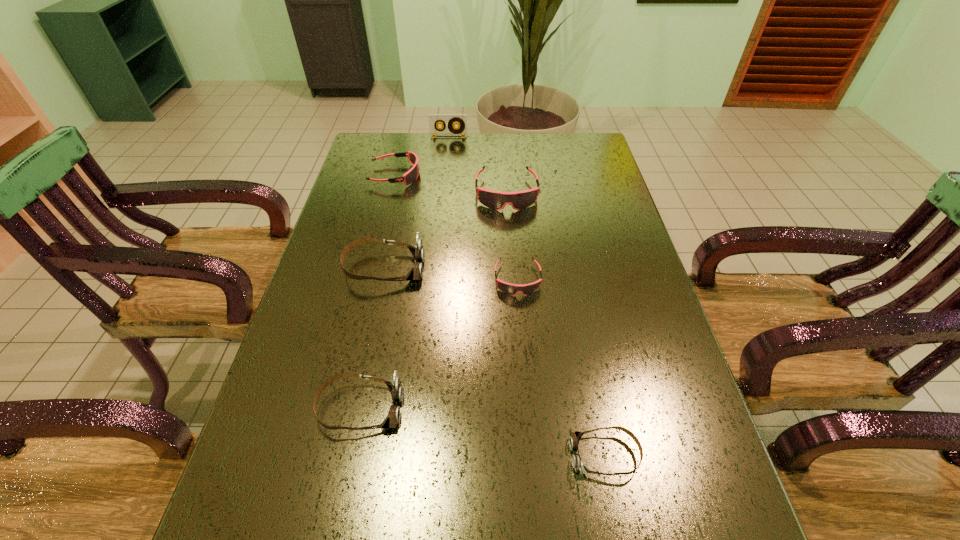
Identify which pink goggles is the nearest to the nearest pink goggles. Please provide its 2D coordinates. Your answer should be formatted as a tuple, i.e. [(x, y)], where the tuple contains the x and y coordinates of a point satisfying the conditions above.

[(495, 200)]

Where is `the third closest brown goggles to the second smallest pink goggles`? Image resolution: width=960 pixels, height=540 pixels. the third closest brown goggles to the second smallest pink goggles is located at coordinates (575, 437).

Find the location of a particular element. This screenshot has width=960, height=540. brown goggles that stands as the third closest to the videotape is located at coordinates (575, 437).

Where is `free space that satisfies the following two spatial constraints: 1. at the front of the tallest object with visible reels; 2. on the front-facing side of the second biggest brown goggles`? The height and width of the screenshot is (540, 960). free space that satisfies the following two spatial constraints: 1. at the front of the tallest object with visible reels; 2. on the front-facing side of the second biggest brown goggles is located at coordinates (422, 408).

Where is `free space that satisfies the following two spatial constraints: 1. on the front-facing side of the smallest pink goggles; 2. on the front-facing side of the second smallest brown goggles`? The height and width of the screenshot is (540, 960). free space that satisfies the following two spatial constraints: 1. on the front-facing side of the smallest pink goggles; 2. on the front-facing side of the second smallest brown goggles is located at coordinates (528, 408).